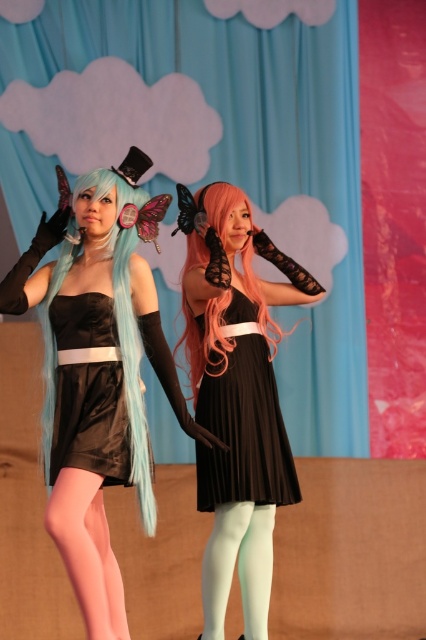
Consider the image. You are a photographer setting up for a photoshoot. You need to position a lighting rig between the matte black dress at center and the light blue matte tights at lower center. Based on their widths, will the rig fit if it requires 1 meter of space?

The matte black dress at center might be wider than light blue matte tights at lower center, but the exact width difference is unknown. Without specific measurements, it is uncertain if the 1 meter space requirement for the lighting rig will be met.

You are a photographer setting up a shoot for a magazine. You need to capture the pink satin tights at lower left and the light blue matte tights at lower center in the same frame. Which of these two items is covering part of the other?

The pink satin tights at lower left is positioned over the light blue matte tights at lower center, so it is covering part of the latter.